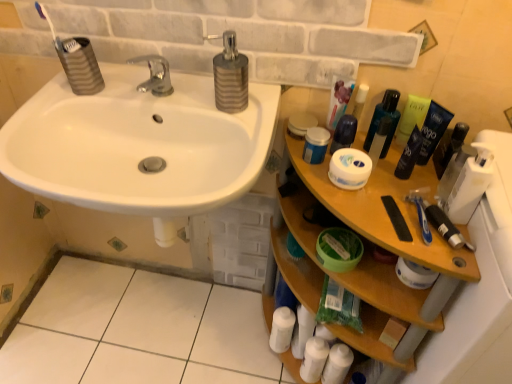
Image resolution: width=512 pixels, height=384 pixels. Identify the location of vacant space underneath white glossy sink at upper left (from a real-world perspective). (178, 329).